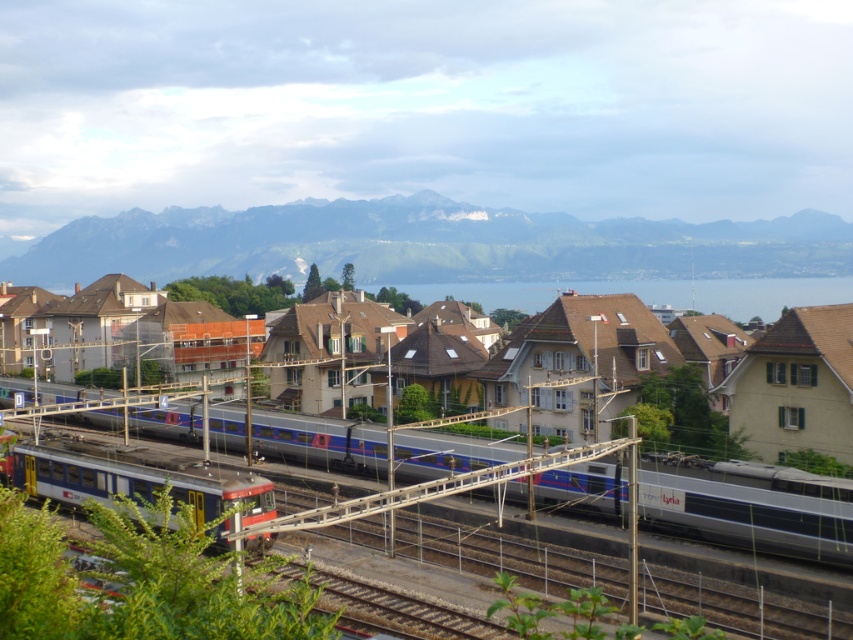
Question: Which of these objects is positioned closest to the blue metallic train at lower left?

Choices:
 (A) silver metallic train at center
 (B) matte blue train at center

Answer: (A)

Question: Which is nearer to the silver metallic train at center?

Choices:
 (A) blue water at center
 (B) matte blue train at center
 (C) snowy rocky mountain at upper center

Answer: (B)

Question: Is blue metallic train at lower left below blue water at center?

Choices:
 (A) yes
 (B) no

Answer: (A)

Question: Considering the relative positions of blue metallic train at lower left and blue water at center in the image provided, where is blue metallic train at lower left located with respect to blue water at center?

Choices:
 (A) right
 (B) left

Answer: (B)

Question: Which object is the farthest from the blue water at center?

Choices:
 (A) blue metallic train at lower left
 (B) matte blue train at center

Answer: (A)

Question: Can you confirm if silver metallic train at center is positioned below blue water at center?

Choices:
 (A) no
 (B) yes

Answer: (B)